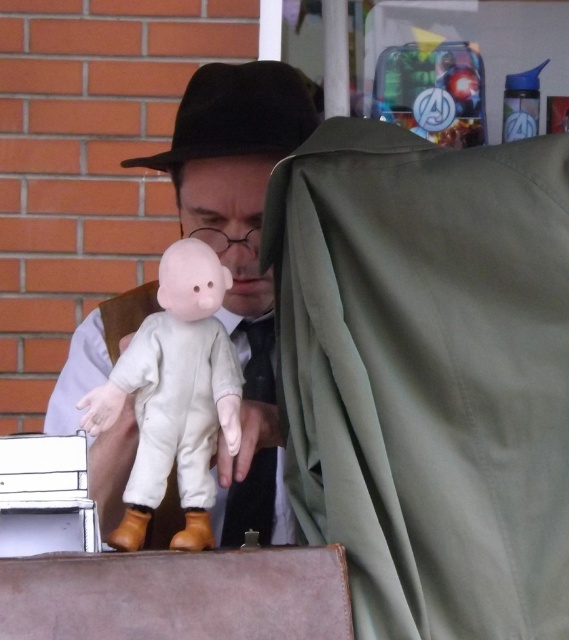
Question: Is the position of white fabric doll at center less distant than that of black satin tie at center?

Choices:
 (A) yes
 (B) no

Answer: (A)

Question: Does matte white doll at center have a smaller size compared to black satin tie at center?

Choices:
 (A) no
 (B) yes

Answer: (A)

Question: Which object is closer to the camera taking this photo?

Choices:
 (A) black satin tie at center
 (B) black felt fedora at upper center
 (C) white fabric doll at center
 (D) matte white doll at center

Answer: (C)

Question: Which point is closer to the camera taking this photo?

Choices:
 (A) (294, 524)
 (B) (167, 417)

Answer: (B)

Question: Does matte white doll at center lie in front of black felt fedora at upper center?

Choices:
 (A) no
 (B) yes

Answer: (B)

Question: Which object is farther from the camera taking this photo?

Choices:
 (A) black satin tie at center
 (B) white fabric doll at center

Answer: (A)